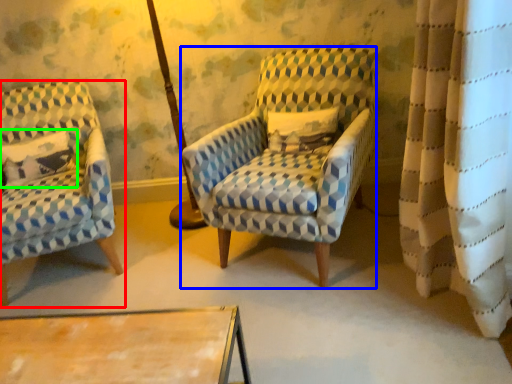
Question: Considering the real-world distances, which object is farthest from chair (highlighted by a red box)? chair (highlighted by a blue box) or pillow (highlighted by a green box)?

Choices:
 (A) chair
 (B) pillow

Answer: (A)